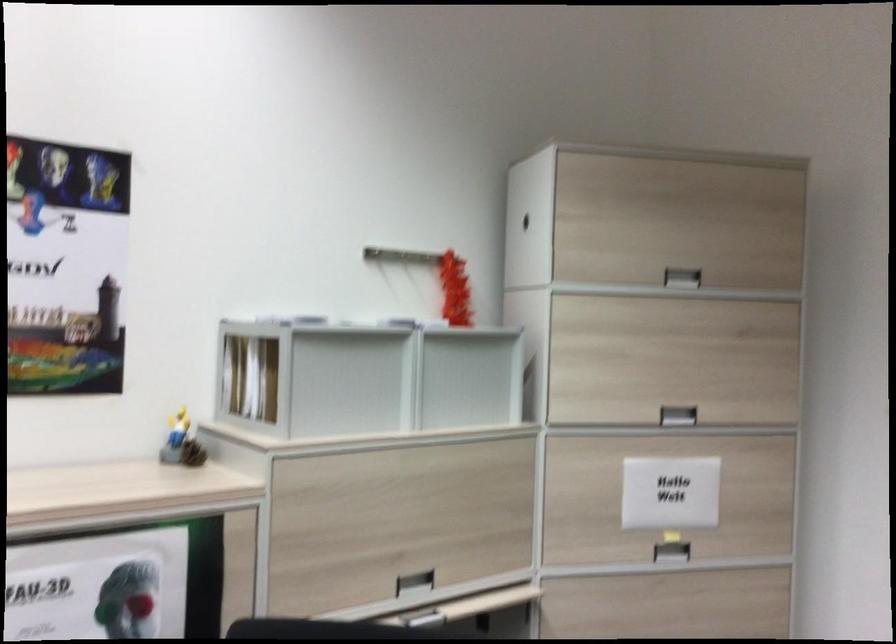
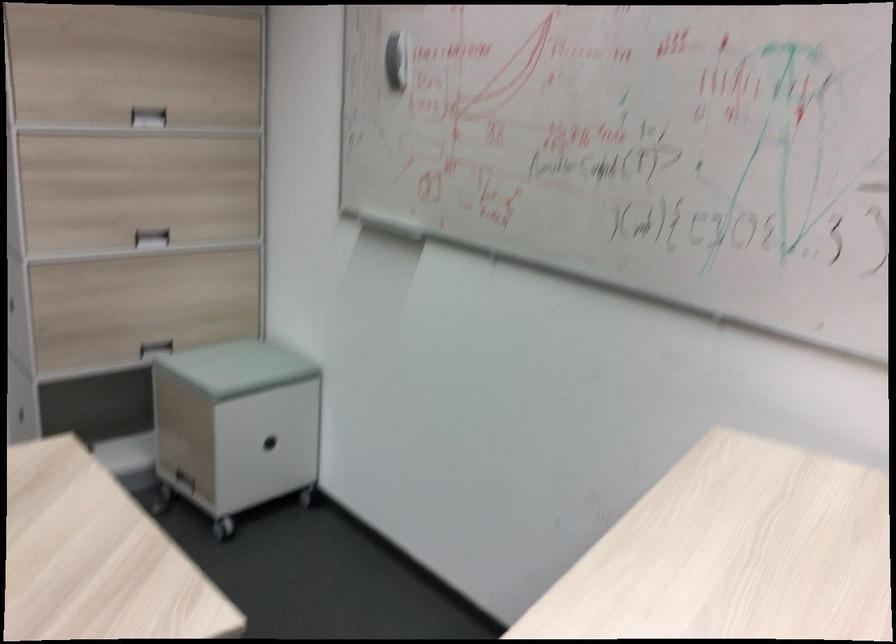
First-person continuous shooting, in which direction is the camera rotating?

The rotation direction of the camera is right-down.